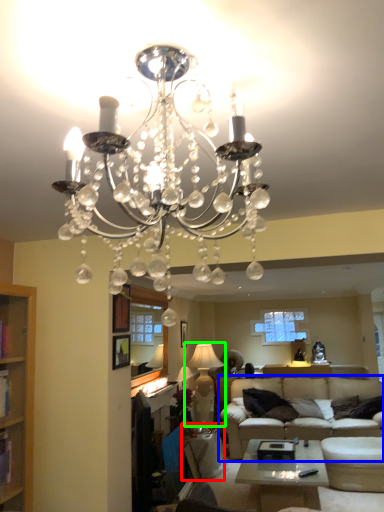
Question: Which object is the closest to the side table (highlighted by a red box)? Choose among these: studio couch (highlighted by a blue box) or lamp (highlighted by a green box).

Choices:
 (A) studio couch
 (B) lamp

Answer: (A)